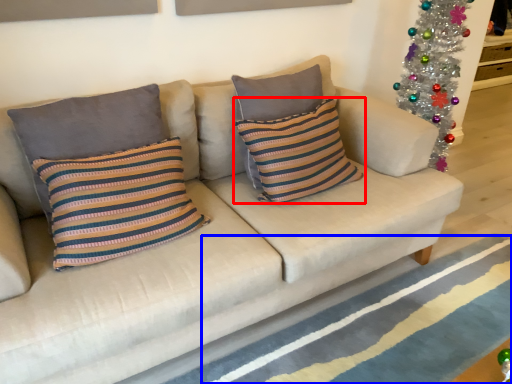
Question: Which point is further to the camera, pillow (highlighted by a red box) or stripe (highlighted by a blue box)?

Choices:
 (A) pillow
 (B) stripe

Answer: (A)